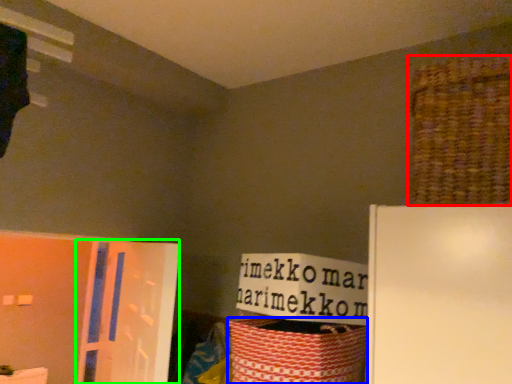
Question: Considering the real-world distances, which object is closest to basket (highlighted by a red box)? basket (highlighted by a blue box) or screen door (highlighted by a green box).

Choices:
 (A) basket
 (B) screen door

Answer: (A)